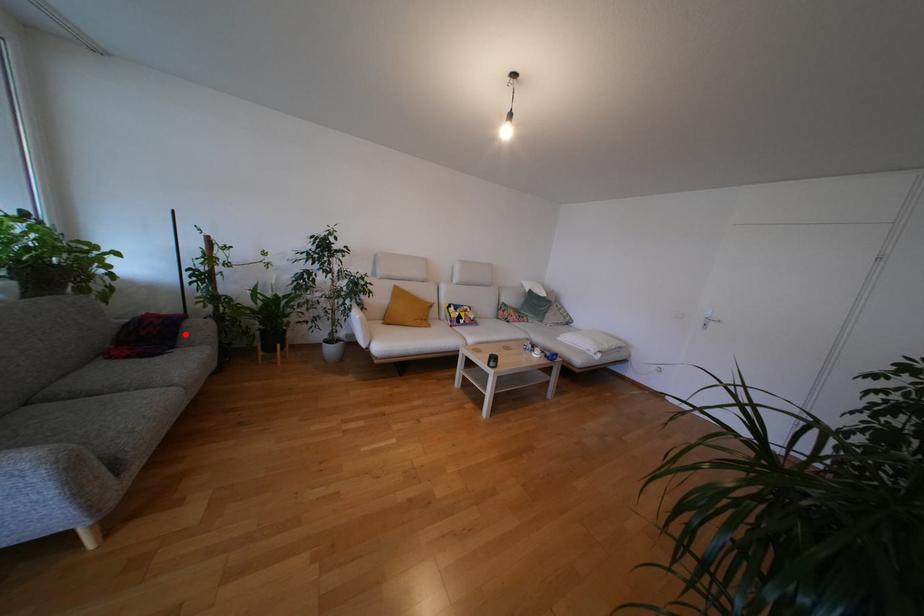
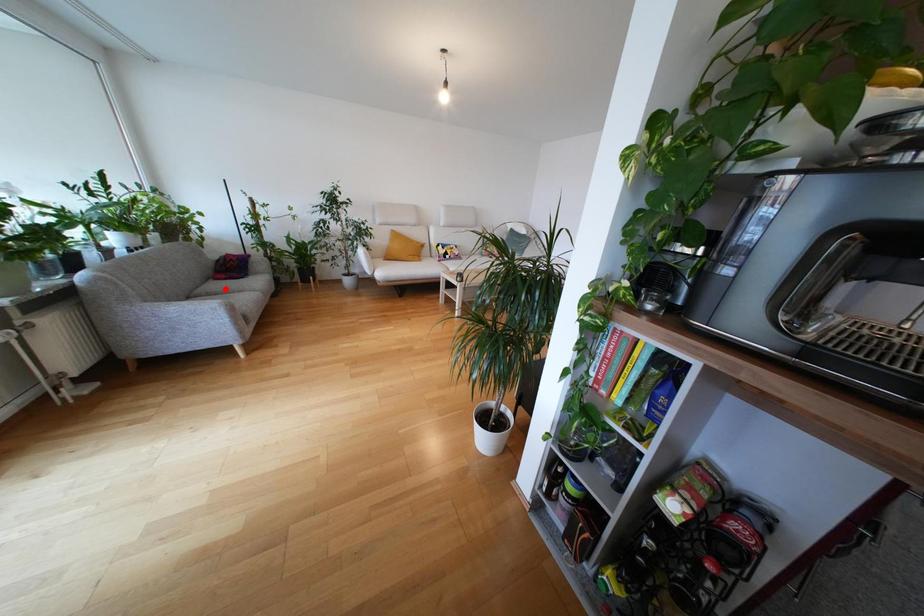
I am providing you with two images of the same scene from different viewpoints. A red point is marked on the first image and another point is marked on the second image. Do the highlighted points in image1 and image2 indicate the same real-world spot?

No